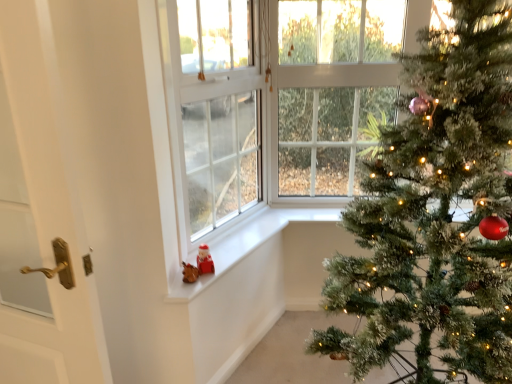
Question: Is green textured christmas tree at right bigger than white plastic window screen at lower left?

Choices:
 (A) no
 (B) yes

Answer: (B)

Question: Is green textured christmas tree at right behind white plastic window screen at lower left?

Choices:
 (A) yes
 (B) no

Answer: (B)

Question: Considering the relative positions of green textured christmas tree at right and white plastic window screen at lower left in the image provided, is green textured christmas tree at right to the right of white plastic window screen at lower left from the viewer's perspective?

Choices:
 (A) yes
 (B) no

Answer: (A)

Question: Are green textured christmas tree at right and white plastic window screen at lower left making contact?

Choices:
 (A) no
 (B) yes

Answer: (A)

Question: Could you tell me if green textured christmas tree at right is turned towards white plastic window screen at lower left?

Choices:
 (A) yes
 (B) no

Answer: (B)

Question: Does green textured christmas tree at right have a greater width compared to white plastic window screen at lower left?

Choices:
 (A) no
 (B) yes

Answer: (B)

Question: From the image's perspective, is white glossy door at left under white plastic window screen at lower left?

Choices:
 (A) yes
 (B) no

Answer: (A)

Question: Is white glossy door at left positioned with its back to white plastic window screen at lower left?

Choices:
 (A) yes
 (B) no

Answer: (A)

Question: Is white glossy door at left not near white plastic window screen at lower left?

Choices:
 (A) no
 (B) yes

Answer: (A)

Question: Is white glossy door at left positioned beyond the bounds of white plastic window screen at lower left?

Choices:
 (A) no
 (B) yes

Answer: (B)

Question: Is white plastic window screen at lower left located within white glossy door at left?

Choices:
 (A) no
 (B) yes

Answer: (A)

Question: Is white glossy door at left wider than white plastic window screen at lower left?

Choices:
 (A) yes
 (B) no

Answer: (B)

Question: Can you confirm if white plastic window screen at lower left is wider than white matte window sill at lower center?

Choices:
 (A) yes
 (B) no

Answer: (B)